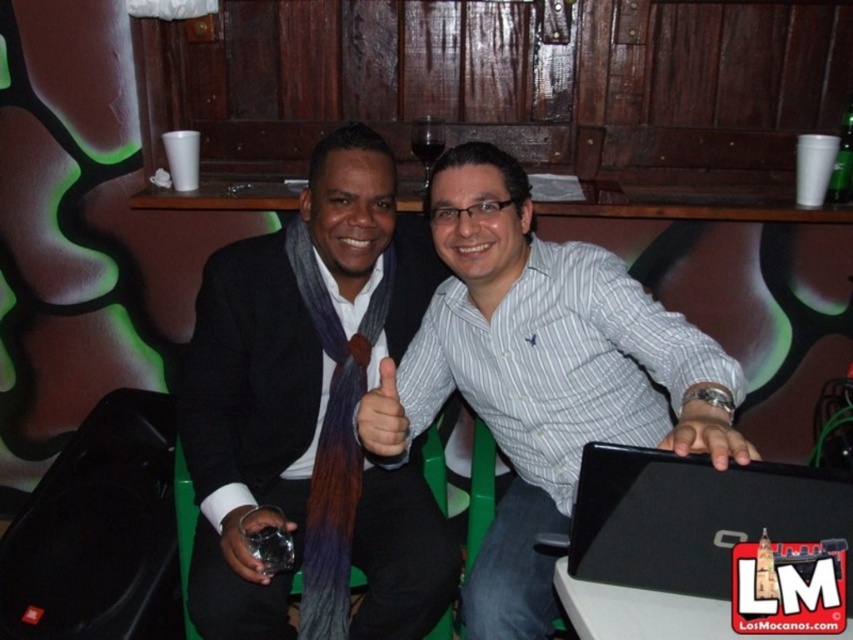
Question: Is white glossy table at lower center positioned in front of matte brown tie at center?

Choices:
 (A) yes
 (B) no

Answer: (A)

Question: Is matte black glass at center above green glass bottle at upper right?

Choices:
 (A) no
 (B) yes

Answer: (A)

Question: Which of these objects is positioned closest to the white striped shirt at center?

Choices:
 (A) matte black suit at center
 (B) black matte laptop at center

Answer: (A)

Question: Which of the following is the closest to the observer?

Choices:
 (A) (212, 492)
 (B) (640, 636)

Answer: (B)

Question: Can you confirm if white striped shirt at center is wider than purple woolen tie at center?

Choices:
 (A) yes
 (B) no

Answer: (A)

Question: Among these objects, which one is nearest to the camera?

Choices:
 (A) black matte laptop at center
 (B) white glossy table at lower center
 (C) green glass bottle at upper right
 (D) smooth skin hand at center

Answer: (D)